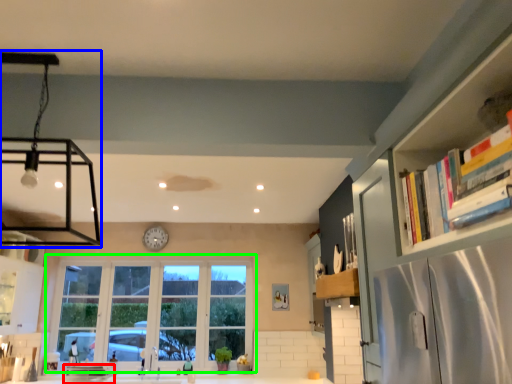
Question: Which object is the farthest from appliance (highlighted by a red box)? Choose among these: light fixture (highlighted by a blue box) or window (highlighted by a green box).

Choices:
 (A) light fixture
 (B) window

Answer: (A)